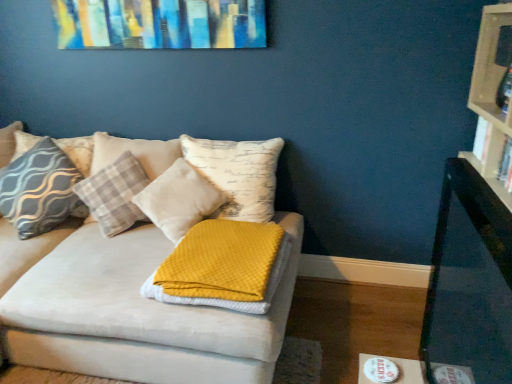
Question: Is waffle-textured yellow blanket at center looking in the opposite direction of hardcover book at right, which is the 1th book from front to back?

Choices:
 (A) no
 (B) yes

Answer: (A)

Question: Is waffle-textured yellow blanket at center not inside hardcover book at right, which is the 1th book from front to back?

Choices:
 (A) no
 (B) yes

Answer: (B)

Question: Can you confirm if waffle-textured yellow blanket at center is bigger than hardcover book at right, acting as the second book starting from the back?

Choices:
 (A) no
 (B) yes

Answer: (B)

Question: Does waffle-textured yellow blanket at center have a greater height compared to hardcover book at right, acting as the second book starting from the back?

Choices:
 (A) yes
 (B) no

Answer: (B)

Question: From a real-world perspective, is waffle-textured yellow blanket at center positioned over hardcover book at right, which is the 1th book from front to back, based on gravity?

Choices:
 (A) yes
 (B) no

Answer: (B)

Question: Is plaid fabric pillow at left, acting as the first pillow starting from the left, wider or thinner than hardcover book at right, which is the 1th book from front to back?

Choices:
 (A) thin
 (B) wide

Answer: (B)

Question: Relative to hardcover book at right, which is the 1th book from front to back, is plaid fabric pillow at left, acting as the first pillow starting from the left, in front or behind?

Choices:
 (A) behind
 (B) front

Answer: (A)

Question: Is plaid fabric pillow at left, acting as the first pillow starting from the left, situated inside hardcover book at right, which is the 1th book from front to back, or outside?

Choices:
 (A) outside
 (B) inside

Answer: (A)

Question: Is point (31, 135) closer or farther from the camera than point (508, 155)?

Choices:
 (A) farther
 (B) closer

Answer: (A)

Question: From a real-world perspective, relative to black glossy table at right, is soft white pillow at center, the 3th pillow in the left-to-right sequence, vertically above or below?

Choices:
 (A) above
 (B) below

Answer: (B)

Question: From the image's perspective, relative to black glossy table at right, is soft white pillow at center, which appears as the 1th pillow when viewed from the right, above or below?

Choices:
 (A) above
 (B) below

Answer: (A)

Question: In terms of size, does soft white pillow at center, the 3th pillow in the left-to-right sequence, appear bigger or smaller than black glossy table at right?

Choices:
 (A) small
 (B) big

Answer: (A)

Question: Considering the positions of soft white pillow at center, which appears as the 1th pillow when viewed from the right, and black glossy table at right in the image, is soft white pillow at center, which appears as the 1th pillow when viewed from the right, wider or thinner than black glossy table at right?

Choices:
 (A) wide
 (B) thin

Answer: (A)

Question: In the image, is soft white pillow at center, the 3th pillow in the left-to-right sequence, positioned in front of or behind hardcover book at right, which is the 1th book from front to back?

Choices:
 (A) front
 (B) behind

Answer: (B)

Question: Looking at their shapes, would you say soft white pillow at center, the 3th pillow in the left-to-right sequence, is wider or thinner than hardcover book at right, which is the 1th book from front to back?

Choices:
 (A) thin
 (B) wide

Answer: (B)